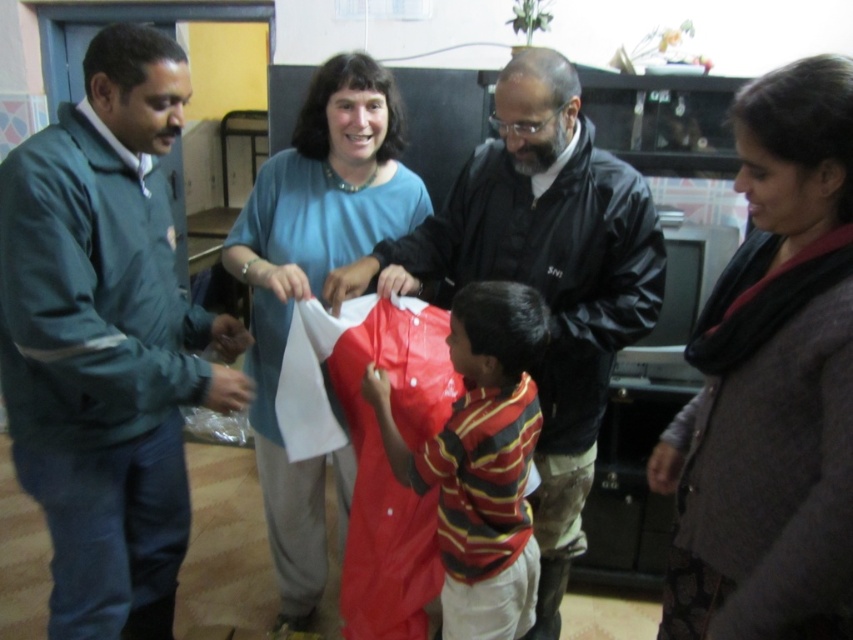
Which of these two, green fabric jacket at left or black leather jacket at center, stands shorter?

With less height is green fabric jacket at left.

Is point (4, 228) closer to viewer compared to point (598, 193)?

Yes.

Is point (107, 72) behind point (508, 211)?

No, (107, 72) is closer to viewer.

Locate an element on the screen. The image size is (853, 640). green fabric jacket at left is located at coordinates (106, 339).

What are the coordinates of `dark gray sweater at center` in the screenshot? It's located at (775, 381).

Is dark gray sweater at center to the right of red shiny shirt at center from the viewer's perspective?

Indeed, dark gray sweater at center is positioned on the right side of red shiny shirt at center.

Who is more forward, [849,138] or [476,291]?

Point [849,138]

Identify the location of dark gray sweater at center. (775, 381).

Can you confirm if green fabric jacket at left is wider than blue matte shirt at center?

No.

Between green fabric jacket at left and blue matte shirt at center, which one appears on the left side from the viewer's perspective?

green fabric jacket at left is more to the left.

Locate an element on the screen. The image size is (853, 640). green fabric jacket at left is located at coordinates (106, 339).

I want to click on green fabric jacket at left, so pyautogui.click(x=106, y=339).